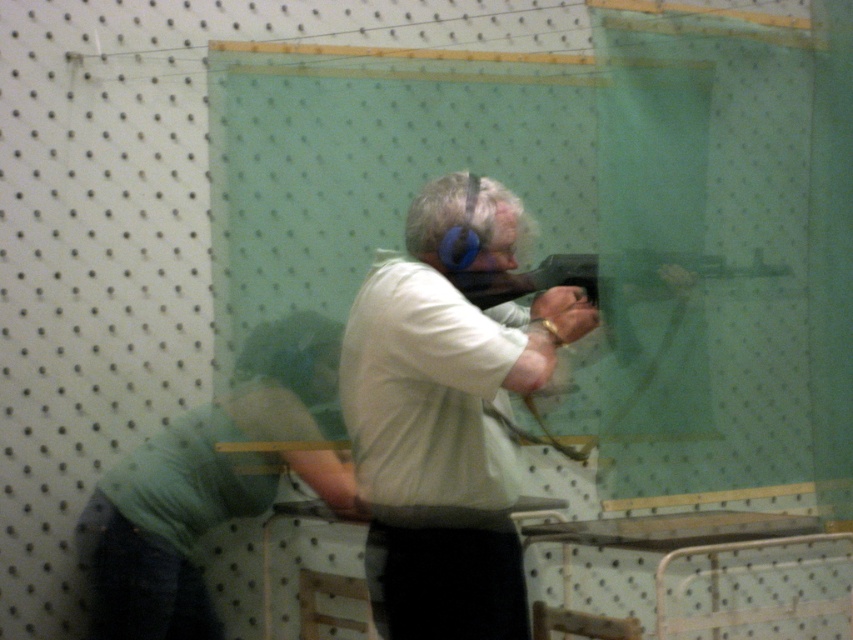
Does white matte shirt at center have a lesser width compared to light green shirt at center?

Yes.

Does white matte shirt at center have a greater width compared to light green shirt at center?

No, white matte shirt at center is not wider than light green shirt at center.

Is point (341, 358) positioned after point (318, 435)?

No, (341, 358) is in front of (318, 435).

This screenshot has height=640, width=853. Identify the location of white matte shirt at center. (448, 412).

Does light green shirt at center have a greater width compared to matte black gun at center?

Incorrect, light green shirt at center's width does not surpass matte black gun at center's.

Is light green shirt at center to the right of matte black gun at center from the viewer's perspective?

Incorrect, light green shirt at center is not on the right side of matte black gun at center.

Who is more forward, (200,580) or (473,291)?

Point (473,291) is in front.

You are a GUI agent. You are given a task and a screenshot of the screen. Output one action in this format:
    pyautogui.click(x=<x>, y=<y>)
    Task: Click on the light green shirt at center
    
    Given the screenshot: What is the action you would take?
    pyautogui.click(x=213, y=483)

Can you confirm if white matte shirt at center is bigger than matte black gun at center?

Yes.

I want to click on white matte shirt at center, so click(x=448, y=412).

Is point (454, 577) positioned before point (631, 275)?

Yes, it is.

Locate an element on the screen. This screenshot has height=640, width=853. white matte shirt at center is located at coordinates (448, 412).